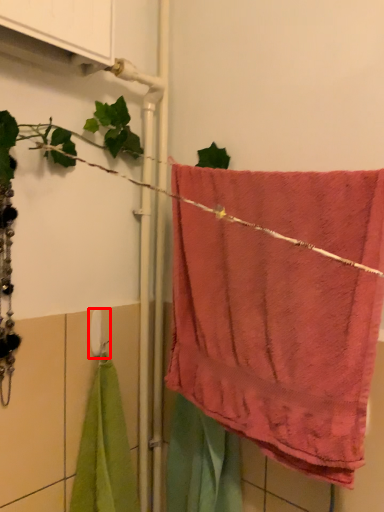
Question: In this image, where is towel bar (annotated by the red box) located relative to towel?

Choices:
 (A) left
 (B) right

Answer: (A)